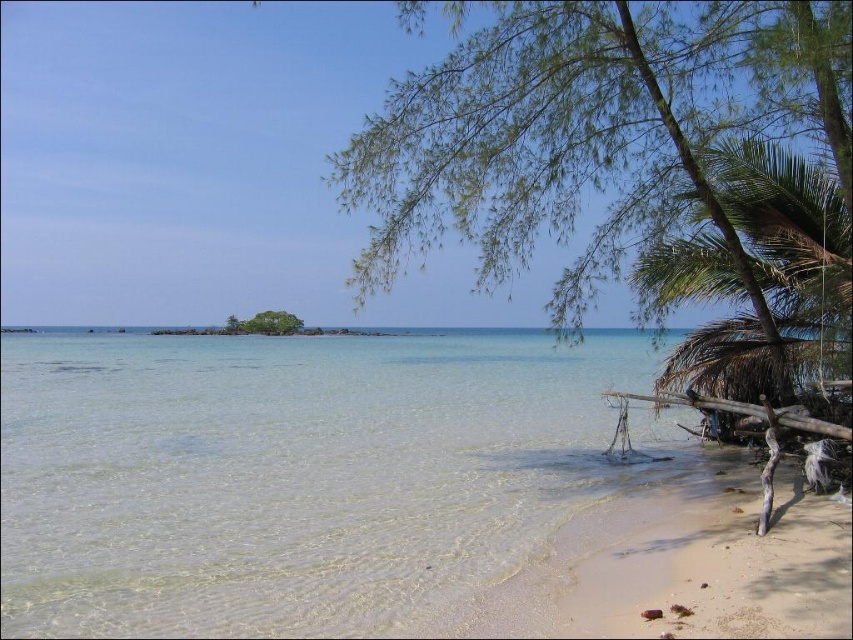
Question: Which of the following is the closest to the observer?

Choices:
 (A) clear water at center
 (B) green leafy tree at right

Answer: (A)

Question: Does clear water at center appear on the left side of green leafy tree at right?

Choices:
 (A) yes
 (B) no

Answer: (A)

Question: Among these objects, which one is farthest from the camera?

Choices:
 (A) green leafy tree at center
 (B) green leafy tree at right

Answer: (A)

Question: Which point appears farthest from the camera in this image?

Choices:
 (A) (514, 68)
 (B) (369, 429)
 (C) (270, 314)

Answer: (C)

Question: Does clear water at center come behind green leafy tree at center?

Choices:
 (A) no
 (B) yes

Answer: (A)

Question: Does clear water at center appear on the right side of green leafy tree at right?

Choices:
 (A) no
 (B) yes

Answer: (A)